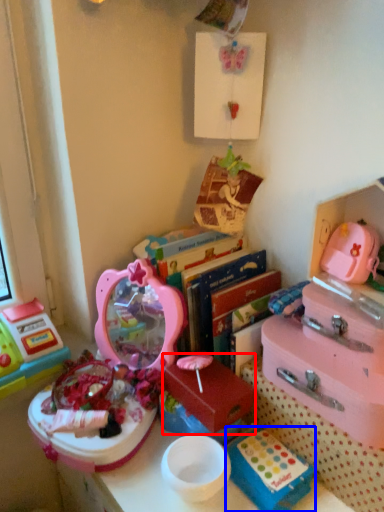
Question: Which of the following is the closest to the observer, storage box (highlighted by a red box) or storage box (highlighted by a blue box)?

Choices:
 (A) storage box
 (B) storage box

Answer: (B)